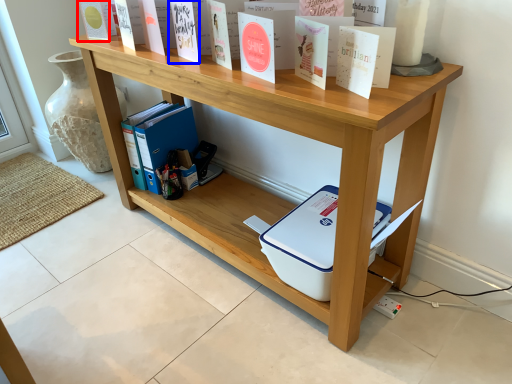
Question: Which of the following is the farthest to the observer, paperback book (highlighted by a red box) or paperback book (highlighted by a blue box)?

Choices:
 (A) paperback book
 (B) paperback book

Answer: (A)